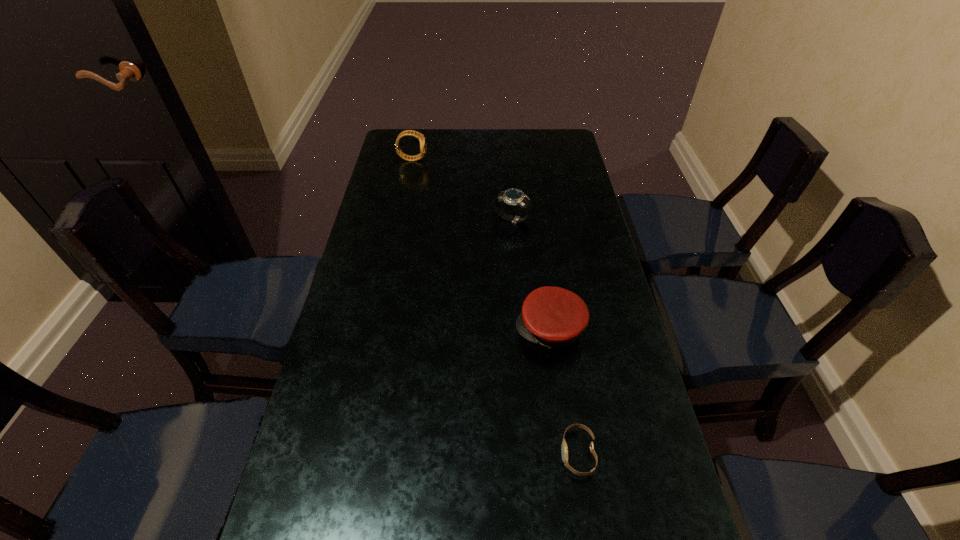
Find the location of `object located at the far left corner`. object located at the far left corner is located at coordinates (422, 139).

Find the location of a particular element. free spot at the far edge of the desktop is located at coordinates (491, 131).

This screenshot has height=540, width=960. In the image, there is a desktop. What are the coordinates of `vacant space at the left edge` in the screenshot? It's located at click(x=372, y=392).

At what (x,y) coordinates should I click in order to perform the action: click on blank space at the right edge. Please return your answer as a coordinate pair (x, y). Image resolution: width=960 pixels, height=540 pixels. Looking at the image, I should click on (556, 202).

The image size is (960, 540). Find the location of `blank region between the cap and the rightmost watch`. blank region between the cap and the rightmost watch is located at coordinates (564, 392).

This screenshot has height=540, width=960. Find the location of `empty space between the farthest watch and the nearest object`. empty space between the farthest watch and the nearest object is located at coordinates 495,306.

Image resolution: width=960 pixels, height=540 pixels. I want to click on free area in between the cap and the farthest object, so click(481, 244).

At what (x,y) coordinates should I click in order to perform the action: click on empty space that is in between the farthest object and the nearest watch. Please return your answer as a coordinate pair (x, y). Image resolution: width=960 pixels, height=540 pixels. Looking at the image, I should click on (495, 306).

The width and height of the screenshot is (960, 540). What are the coordinates of `vacant area that lies between the leftmost watch and the second farthest watch` in the screenshot? It's located at click(462, 189).

Where is `unoccupied position between the leftmost object and the cap`? The width and height of the screenshot is (960, 540). unoccupied position between the leftmost object and the cap is located at coordinates (481, 244).